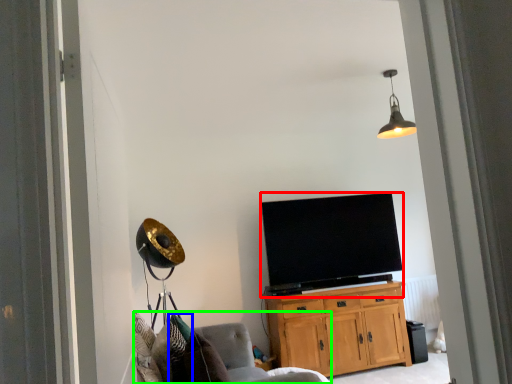
Question: Considering the real-world distances, which object is closest to television (highlighted by a red box)? pillow (highlighted by a blue box) or chair (highlighted by a green box).

Choices:
 (A) pillow
 (B) chair

Answer: (B)